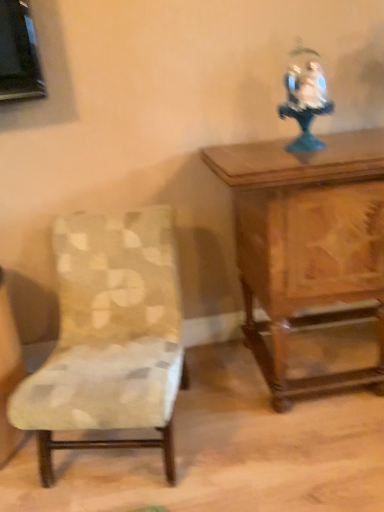
Image resolution: width=384 pixels, height=512 pixels. In order to click on vacant area that is in front of white porcelain figurine at upper right in this screenshot , I will do `click(314, 159)`.